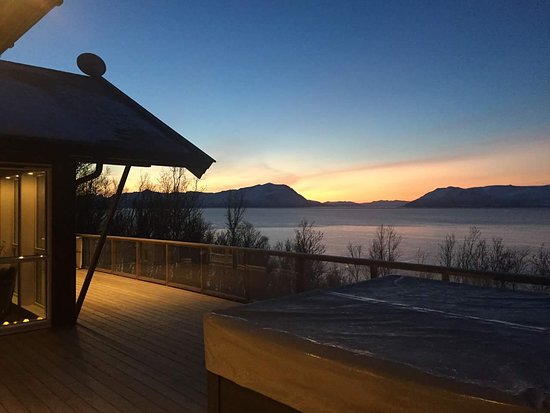
Locate an element on the screen. This screenshot has width=550, height=413. cover is located at coordinates (361, 315).